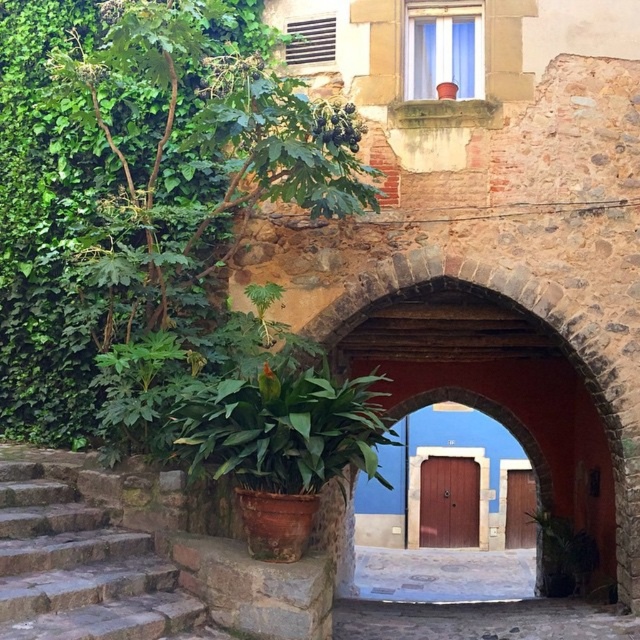
You are standing in front of the stone archway and want to walk towards the green leafy plant at lower right. Which direction should you turn to avoid the brown stone stairs at lower left?

To reach the green leafy plant at lower right while avoiding the brown stone stairs at lower left, you should turn to your right. The brown stone stairs at lower left are in front of the green leafy plant at lower right, so moving to the right would bypass the stairs and allow you to approach the plant directly.

You are standing at the base of the stone steps to the left of the archway. You want to walk towards the archway. Which point, point (218, 637) or point (596, 556), is closer to your current position?

Point (218, 637) is closer to your current position because it is in front of point (596, 556), meaning you would encounter it first while moving towards the archway.

You are a gardener planning to transplant both the green leafy plant at left and the green leafy plant at lower right into new pots. If you want to choose a pot that accommodates the wider plant, which plant should you consider first?

The green leafy plant at left might be wider than the green leafy plant at lower right, so you should consider the green leafy plant at left first for a wider pot.